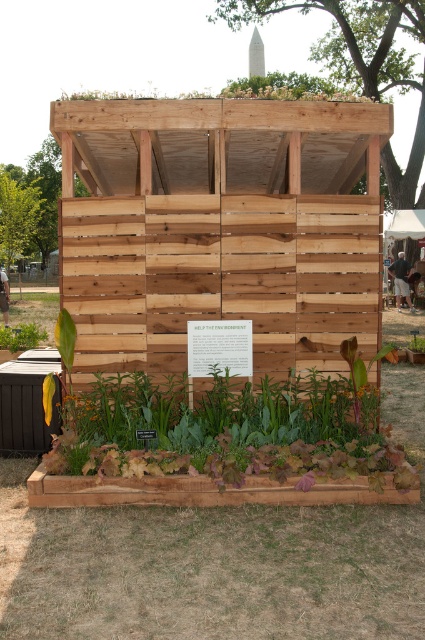
You are standing in front of the wooden structure and want to place a small potted plant between the natural wood shed at center and the green leafy plant at lower left. Which object should the potted plant be placed closer to in order to maintain the existing spatial arrangement?

The natural wood shed at center is closer to the viewer than the green leafy plant at lower left, so to maintain the existing spatial arrangement, the potted plant should be placed closer to the green leafy plant at lower left.

You are planning to place a small birdhouse between the natural wood shed at center and the green leafy plant at lower left. Based on their widths, which object should you place the birdhouse closer to?

The natural wood shed at center might be wider than green leafy plant at lower left, so to ensure the birdhouse is appropriately sized for the space, it should be placed closer to the green leafy plant at lower left.